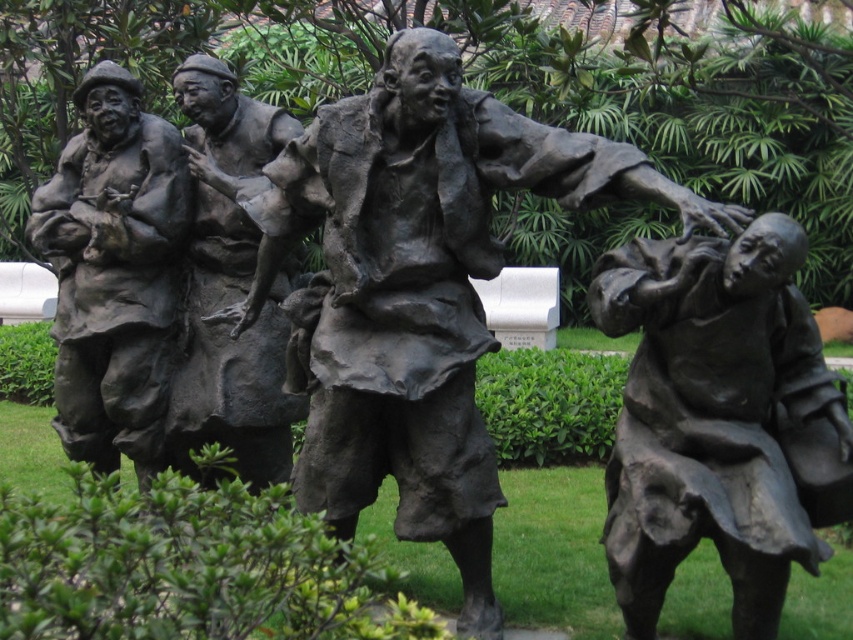
Who is taller, bronze statue at right or bronze statue at left?

bronze statue at left is taller.

Does bronze statue at right appear on the right side of bronze statue at left?

Indeed, bronze statue at right is positioned on the right side of bronze statue at left.

Is point (746, 572) positioned behind point (170, 141)?

No, (746, 572) is closer to viewer.

You are a GUI agent. You are given a task and a screenshot of the screen. Output one action in this format:
    pyautogui.click(x=<x>, y=<y>)
    Task: Click on the bronze statue at right
    This screenshot has height=640, width=853.
    Given the screenshot: What is the action you would take?
    pyautogui.click(x=712, y=417)

Does point (103, 161) come behind point (245, 102)?

No, it is in front of (245, 102).

Who is positioned more to the left, bronze statue at left or bronze statue of man at center?

From the viewer's perspective, bronze statue at left appears more on the left side.

Who is more distant from viewer, (74, 204) or (293, 275)?

The point (293, 275) is more distant.

Identify the location of bronze statue at left. [114, 273].

Who is positioned more to the left, bronze statue at right or bronze statue of man at center?

Positioned to the left is bronze statue of man at center.

In the scene shown: Can you confirm if bronze statue at right is wider than bronze statue of man at center?

Yes, bronze statue at right is wider than bronze statue of man at center.

Does point (839, 433) come closer to viewer compared to point (196, 330)?

Yes, point (839, 433) is closer to viewer.

The width and height of the screenshot is (853, 640). What are the coordinates of `bronze statue at right` in the screenshot? It's located at (712, 417).